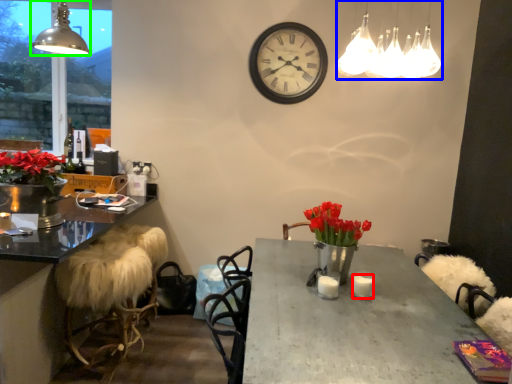
Question: Considering the real-world distances, which object is farthest from candle (highlighted by a red box)? lamp (highlighted by a blue box) or lamp (highlighted by a green box)?

Choices:
 (A) lamp
 (B) lamp

Answer: (B)